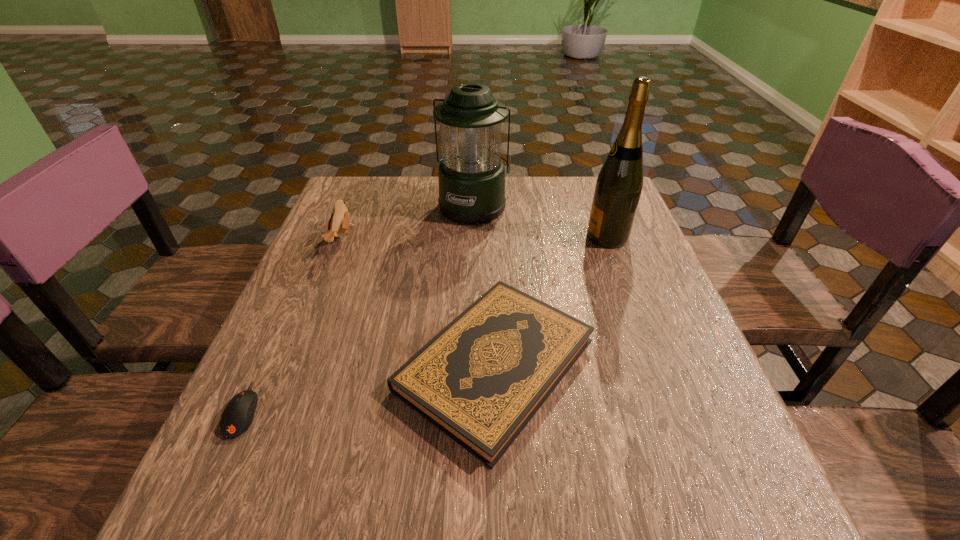
In the image, there is a desktop. In order to click on free region at the near edge in this screenshot , I will do `click(577, 520)`.

This screenshot has height=540, width=960. In the image, there is a desktop. In order to click on blank space at the left edge in this screenshot , I will do `click(350, 290)`.

Locate an element on the screen. The width and height of the screenshot is (960, 540). free region at the right edge of the desktop is located at coordinates (633, 274).

Image resolution: width=960 pixels, height=540 pixels. In order to click on free space at the far left corner of the desktop in this screenshot , I will do `click(364, 191)`.

Locate an element on the screen. This screenshot has height=540, width=960. vacant area that lies between the hardback book and the lantern is located at coordinates (485, 285).

Locate an element on the screen. The image size is (960, 540). vacant area between the second shortest object and the tallest object is located at coordinates (551, 301).

Locate an element on the screen. The width and height of the screenshot is (960, 540). vacant point located between the bird and the leftmost object is located at coordinates (293, 325).

This screenshot has width=960, height=540. In order to click on free spot between the fourth tallest object and the tallest object in this screenshot , I will do `click(551, 301)`.

Where is `free point between the third shortest object and the second shortest object`? free point between the third shortest object and the second shortest object is located at coordinates [419, 303].

Where is `vacant region between the third shortest object and the hardback book`? vacant region between the third shortest object and the hardback book is located at coordinates (419, 303).